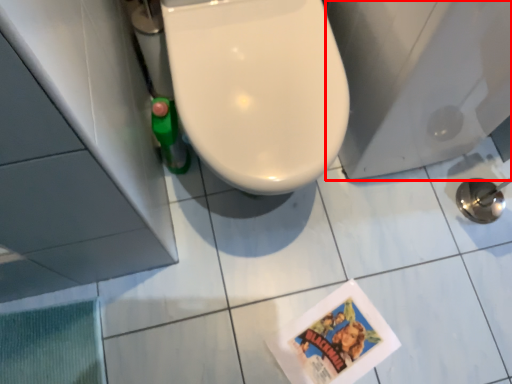
Question: From the image's perspective, where is porcelain (annotated by the red box) located in relation to ceramic tile in the image?

Choices:
 (A) below
 (B) above

Answer: (B)